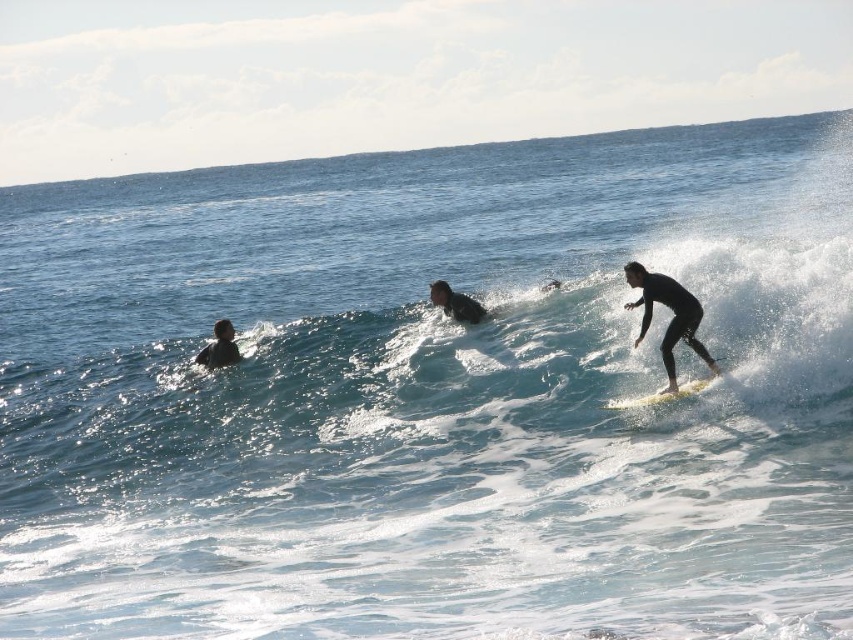
You are a photographer on a boat and want to capture both the black matte wetsuit at right and the black wetsuit surfer at center in a single frame. Which surfer should you position closer to the center of your camera viewfinder to ensure both fit within the frame?

The black matte wetsuit at right is wider than the black wetsuit surfer at center. To ensure both fit in the frame, position the wider black matte wetsuit at right closer to the center of the camera viewfinder so it doesn

You are a photographer on a boat observing the scene. You want to capture a closeup of the black wetsuit surfer at center and the black wetsuit at left. Which one would you need to zoom in less to get a clear photo?

The black wetsuit surfer at center is larger in size than the black wetsuit at left, so you would need to zoom in less to capture the black wetsuit surfer at center clearly.